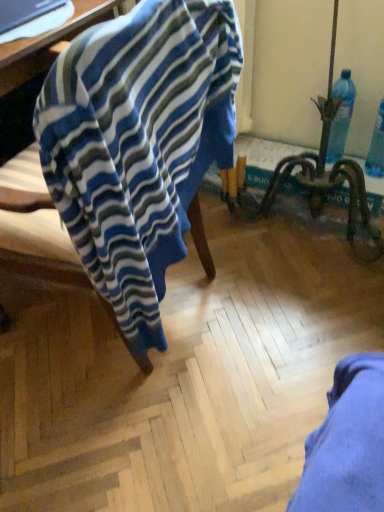
Question: Considering the positions of blue plastic bottle at upper right and blue striped fabric at left in the image, is blue plastic bottle at upper right wider or thinner than blue striped fabric at left?

Choices:
 (A) thin
 (B) wide

Answer: (A)

Question: Looking at the image, does blue plastic bottle at upper right seem bigger or smaller compared to blue striped fabric at left?

Choices:
 (A) big
 (B) small

Answer: (B)

Question: Considering the real-world distances, which object is closest to the blue striped fabric at left?

Choices:
 (A) matte black laptop at upper left
 (B) blue plastic bottle at upper right

Answer: (A)

Question: Which of these objects is positioned closest to the blue plastic bottle at upper right?

Choices:
 (A) blue striped fabric at left
 (B) matte black laptop at upper left

Answer: (A)